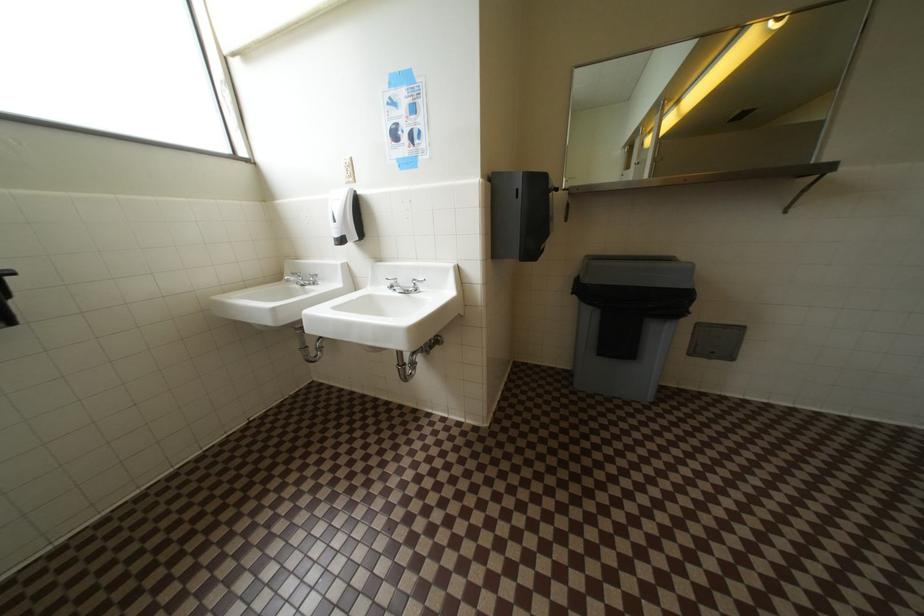
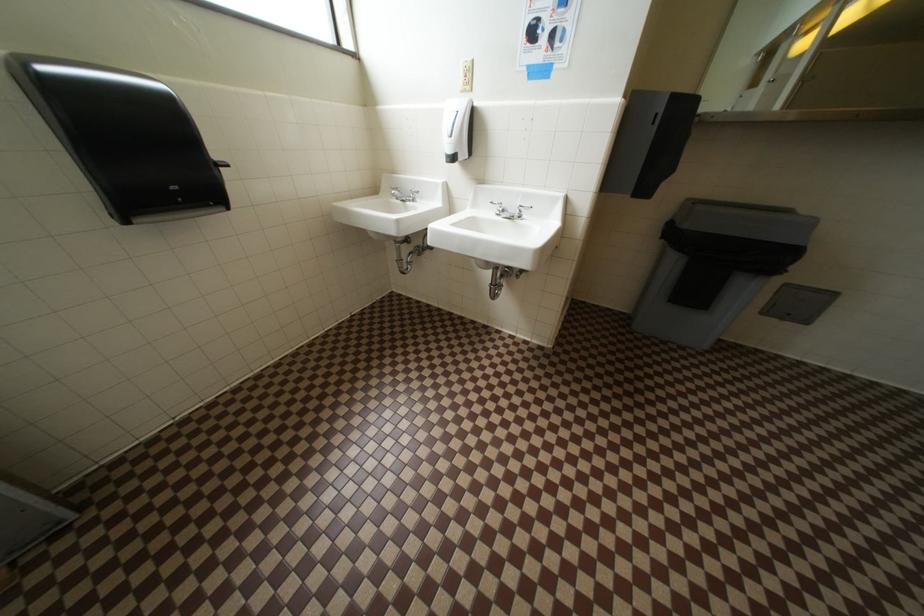
Question: The images are taken continuously from a first-person perspective. In which direction is your viewpoint rotating?

Choices:
 (A) Left
 (B) Right
 (C) Up
 (D) Down

Answer: (D)